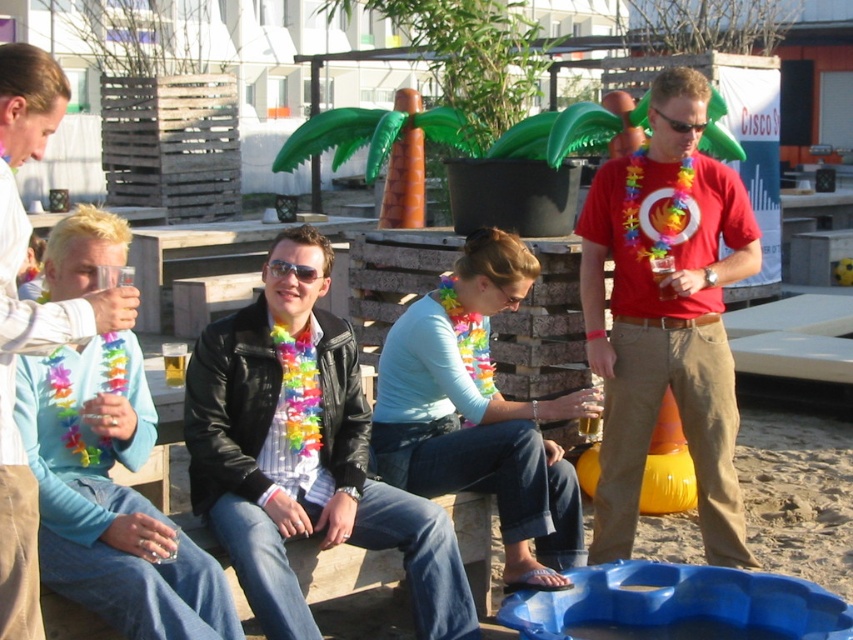
Where is the matte black jacket at left located in the image?

The matte black jacket at left is located at point 0.503 on the x axis and 0.038 on the y axis.